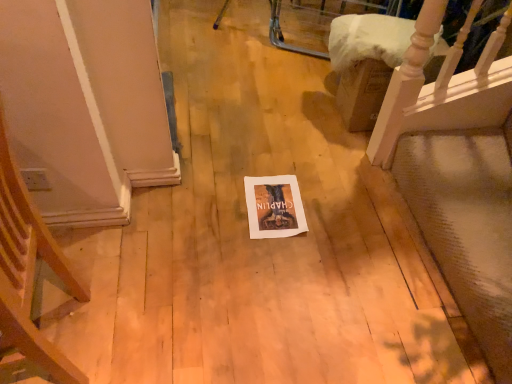
Find the location of a particular element. free space to the back side of wooden armchair at left is located at coordinates (120, 258).